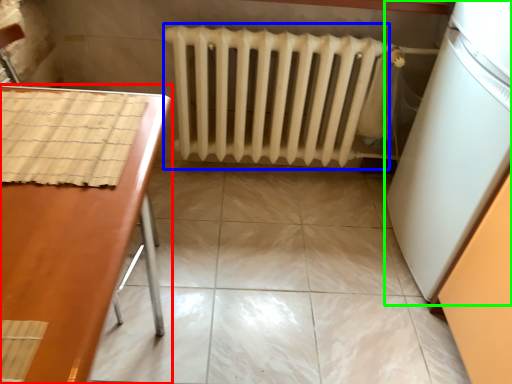
Question: Considering the real-world distances, which object is closest to furniture (highlighted by a red box)? radiator (highlighted by a blue box) or appliance (highlighted by a green box).

Choices:
 (A) radiator
 (B) appliance

Answer: (A)